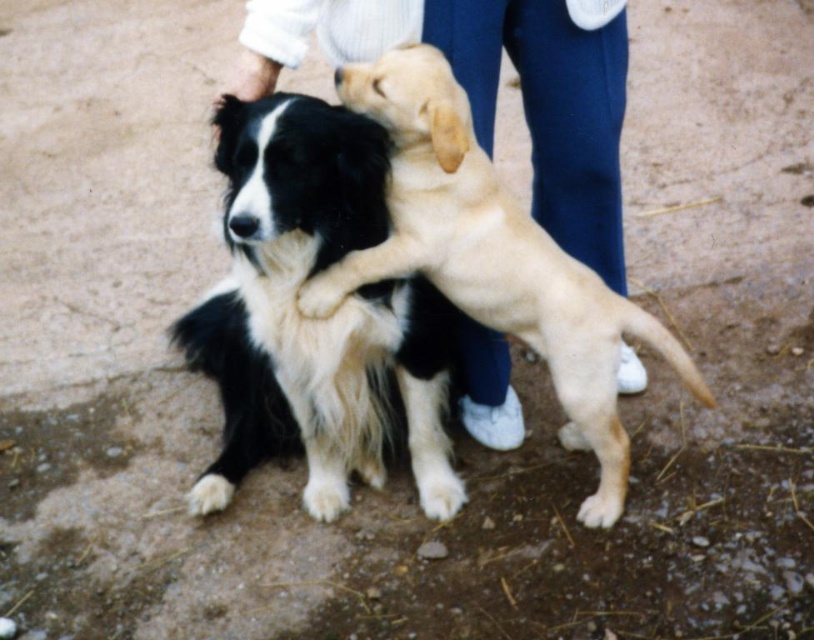
Is black and white fur dog at center closer to the viewer compared to white fur paw at center?

That is True.

Is the position of black and white fur dog at center more distant than that of white fur paw at center?

That is False.

This screenshot has width=814, height=640. Describe the element at coordinates (314, 320) in the screenshot. I see `black and white fur dog at center` at that location.

Locate an element on the screen. The image size is (814, 640). black and white fur dog at center is located at coordinates (314, 320).

Between black and white fur dog at center and light brown fur at center, which one appears on the right side from the viewer's perspective?

light brown fur at center

In the scene shown: Is black and white fur dog at center to the right of light brown fur at center from the viewer's perspective?

In fact, black and white fur dog at center is to the left of light brown fur at center.

Who is more distant from viewer, (294, 224) or (449, 186)?

Positioned behind is point (449, 186).

Identify the location of black and white fur dog at center. This screenshot has height=640, width=814. (314, 320).

In the scene shown: Can you confirm if light brown fur at center is positioned to the right of white fur paw at center?

Correct, you'll find light brown fur at center to the right of white fur paw at center.

Between light brown fur at center and white fur paw at center, which one has more height?

Standing taller between the two is light brown fur at center.

I want to click on light brown fur at center, so click(x=497, y=250).